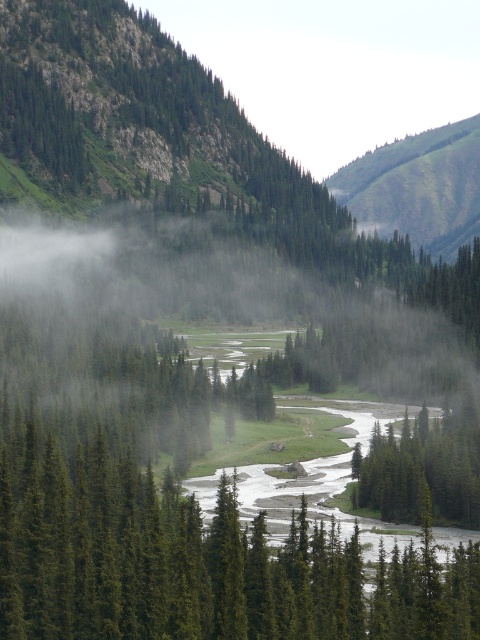
Question: Which point is closer to the camera?

Choices:
 (A) green matte tree at lower right
 (B) green matte tree at center
 (C) green grassy hillside at upper right

Answer: (B)

Question: Which object appears farthest from the camera in this image?

Choices:
 (A) green grassy hillside at upper right
 (B) green matte tree at lower right
 (C) green matte tree at center
 (D) green matte tree at upper left

Answer: (A)

Question: Where is green matte tree at lower right located in relation to green matte tree at upper left in the image?

Choices:
 (A) left
 (B) right

Answer: (B)

Question: Which object is positioned farthest from the green grassy hillside at upper right?

Choices:
 (A) green matte tree at center
 (B) green matte tree at upper left
 (C) green matte tree at lower right

Answer: (A)

Question: Does green grassy hillside at upper right come behind green matte tree at lower right?

Choices:
 (A) yes
 (B) no

Answer: (A)

Question: Is green matte tree at center positioned behind green matte tree at lower right?

Choices:
 (A) no
 (B) yes

Answer: (A)